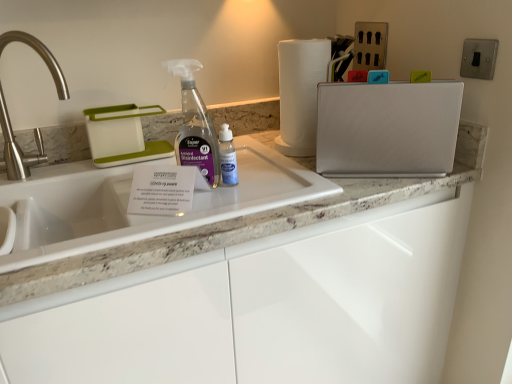
Question: Does brushed metal faucet at left appear on the right side of metallic switch at upper right?

Choices:
 (A) no
 (B) yes

Answer: (A)

Question: Does brushed metal faucet at left have a smaller size compared to metallic switch at upper right?

Choices:
 (A) yes
 (B) no

Answer: (B)

Question: Considering the relative positions of brushed metal faucet at left and metallic switch at upper right in the image provided, is brushed metal faucet at left in front of metallic switch at upper right?

Choices:
 (A) no
 (B) yes

Answer: (B)

Question: From the image's perspective, would you say brushed metal faucet at left is positioned over metallic switch at upper right?

Choices:
 (A) no
 (B) yes

Answer: (A)

Question: Could you tell me if brushed metal faucet at left is turned towards metallic switch at upper right?

Choices:
 (A) no
 (B) yes

Answer: (A)

Question: In terms of size, does white paper towel at upper right appear bigger or smaller than brushed metal faucet at left?

Choices:
 (A) small
 (B) big

Answer: (A)

Question: Is white paper towel at upper right inside or outside of brushed metal faucet at left?

Choices:
 (A) inside
 (B) outside

Answer: (B)

Question: Is white paper towel at upper right wider or thinner than brushed metal faucet at left?

Choices:
 (A) wide
 (B) thin

Answer: (B)

Question: Visually, is white paper towel at upper right positioned to the left or to the right of brushed metal faucet at left?

Choices:
 (A) right
 (B) left

Answer: (A)

Question: Considering the positions of white plastic dish rack at upper left, the first appliance viewed from the left, and white paper towel at upper right in the image, is white plastic dish rack at upper left, the first appliance viewed from the left, taller or shorter than white paper towel at upper right?

Choices:
 (A) short
 (B) tall

Answer: (A)

Question: From a real-world perspective, is white plastic dish rack at upper left, the first appliance viewed from the left, positioned above or below white paper towel at upper right?

Choices:
 (A) below
 (B) above

Answer: (A)

Question: Based on their positions, is white plastic dish rack at upper left, which is counted as the second appliance, starting from the right, located to the left or right of white paper towel at upper right?

Choices:
 (A) right
 (B) left

Answer: (B)

Question: Looking at their shapes, would you say white plastic dish rack at upper left, the first appliance viewed from the left, is wider or thinner than white paper towel at upper right?

Choices:
 (A) wide
 (B) thin

Answer: (B)

Question: Considering the positions of metallic switch at upper right and white textured cutting board at upper right, positioned as the first appliance in right-to-left order, in the image, is metallic switch at upper right wider or thinner than white textured cutting board at upper right, positioned as the first appliance in right-to-left order,?

Choices:
 (A) wide
 (B) thin

Answer: (B)

Question: From their relative heights in the image, would you say metallic switch at upper right is taller or shorter than white textured cutting board at upper right, positioned as the first appliance in right-to-left order?

Choices:
 (A) tall
 (B) short

Answer: (B)